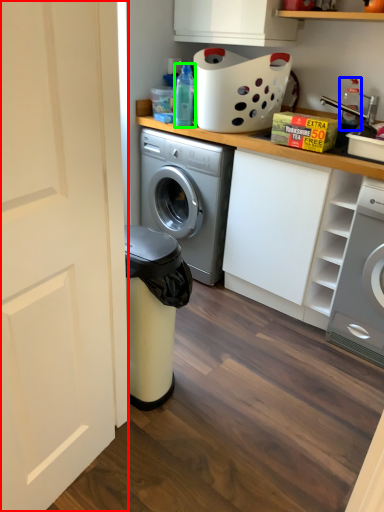
Question: Which is nearer to the door (highlighted by a red box)? cleaning product (highlighted by a blue box) or bottle (highlighted by a green box).

Choices:
 (A) cleaning product
 (B) bottle

Answer: (B)